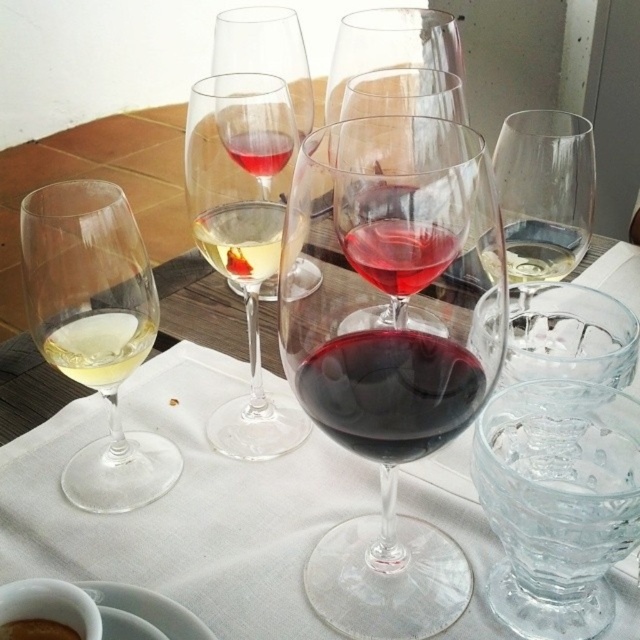
Question: Is translucent glass wine glass at center to the right of clear glass wine glass at center from the viewer's perspective?

Choices:
 (A) yes
 (B) no

Answer: (B)

Question: Which point is closer to the camera?

Choices:
 (A) translucent glass wine glass at center
 (B) white opaque glass at center

Answer: (A)

Question: Which point is farther from the camera taking this photo?

Choices:
 (A) (317, 604)
 (B) (248, 72)
 (C) (205, 216)
 (D) (113, 333)

Answer: (B)

Question: Can you confirm if dark red glass at center is wider than white opaque glass at center?

Choices:
 (A) yes
 (B) no

Answer: (A)

Question: Can you confirm if clear glass at center is smaller than red glass at center?

Choices:
 (A) no
 (B) yes

Answer: (A)

Question: Which of the following is the closest to the observer?

Choices:
 (A) transparent glass wine glass at center
 (B) clear glass wine glass at center
 (C) dark red glass at center

Answer: (A)